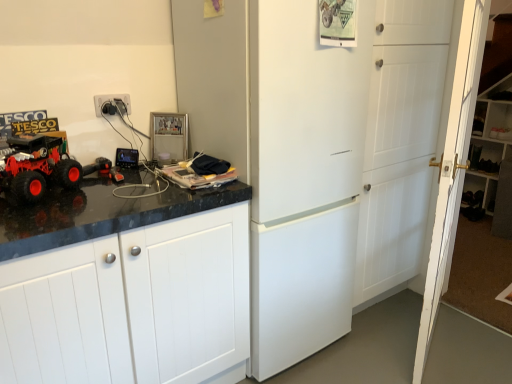
Locate an element on the screen. The image size is (512, 384). vacant location below white wooden door at right, marked as the first door in a right-to-left arrangement (from a real-world perspective) is located at coordinates (433, 343).